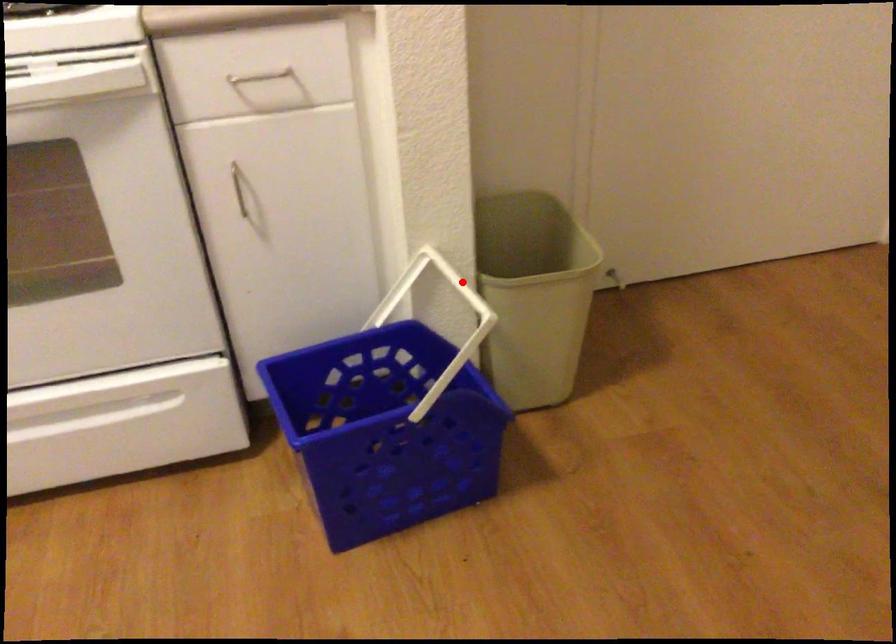
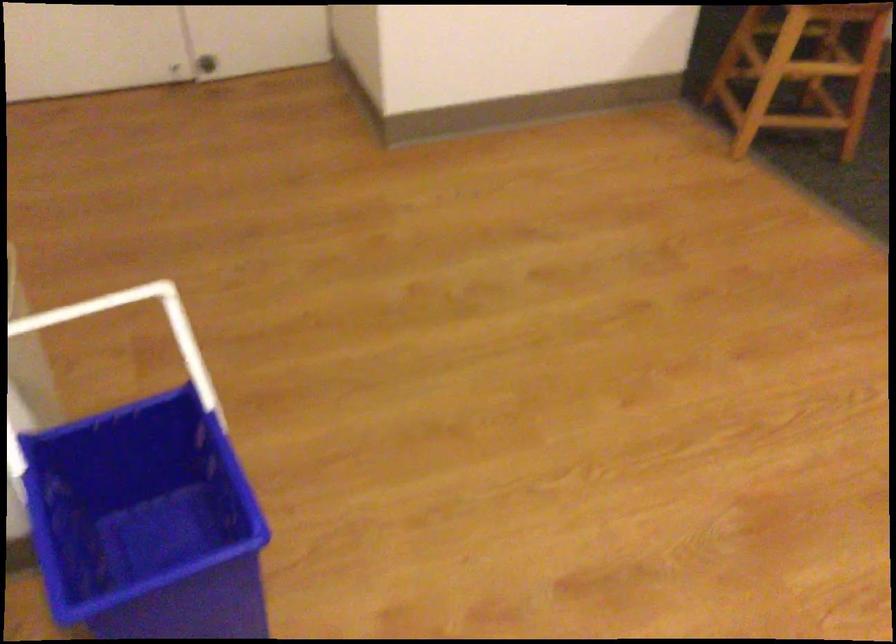
Where in the second image is the point corresponding to the highlighted location from the first image?

(58, 316)